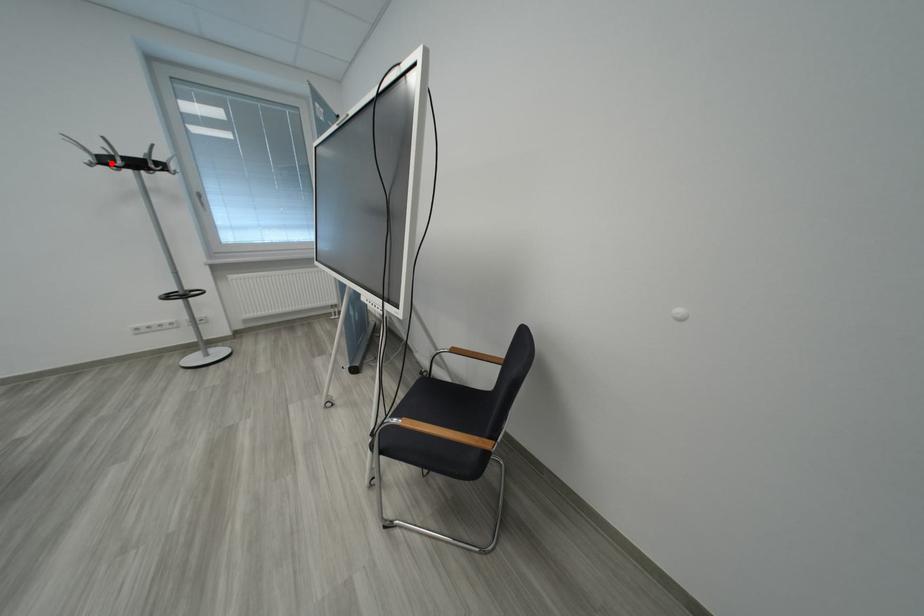
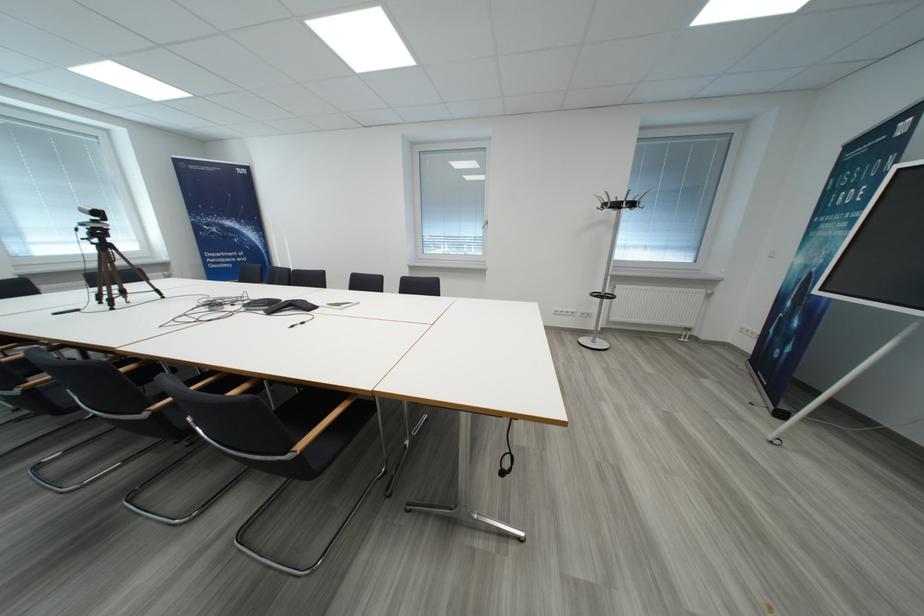
Where in the second image is the point corresponding to the highlighted location from the first image?

(623, 208)